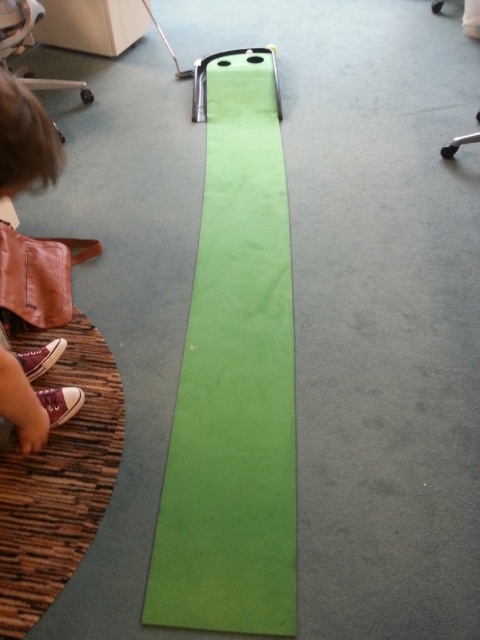
Question: Which of the following is the farthest from the observer?

Choices:
 (A) green matte strip at center
 (B) brown leather shoes at lower left

Answer: (A)

Question: Which point is closer to the camera?

Choices:
 (A) (7, 392)
 (B) (265, 435)

Answer: (A)

Question: Which point is farther to the camera?

Choices:
 (A) (27, 177)
 (B) (250, 547)

Answer: (B)

Question: Is green matte strip at center below brown leather shoes at lower left?

Choices:
 (A) no
 (B) yes

Answer: (A)

Question: Can you confirm if green matte strip at center is positioned to the left of brown leather shoes at lower left?

Choices:
 (A) no
 (B) yes

Answer: (A)

Question: Can you confirm if green matte strip at center is smaller than brown leather shoes at lower left?

Choices:
 (A) yes
 (B) no

Answer: (B)